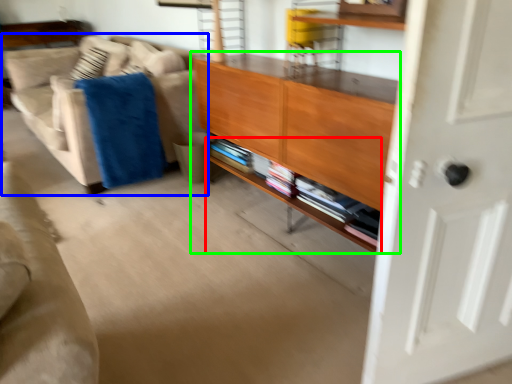
Question: Which object is the closest to the shelf (highlighted by a red box)? Choose among these: studio couch (highlighted by a blue box) or cabinetry (highlighted by a green box).

Choices:
 (A) studio couch
 (B) cabinetry

Answer: (B)